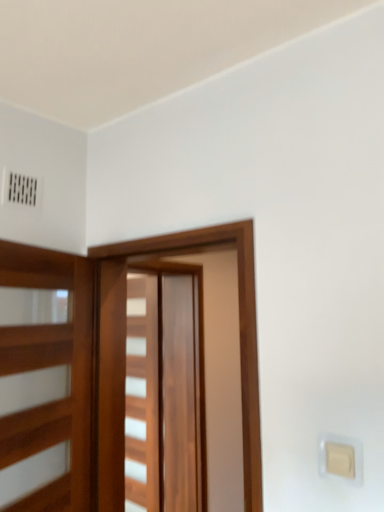
The height and width of the screenshot is (512, 384). Describe the element at coordinates (45, 379) in the screenshot. I see `wooden elevator at left` at that location.

This screenshot has width=384, height=512. Describe the element at coordinates (340, 459) in the screenshot. I see `beige plastic light switch at lower right` at that location.

Find the location of a particular element. The width and height of the screenshot is (384, 512). wooden barn door at center, which is the 1th barn door from front to back is located at coordinates (239, 320).

From the image's perspective, is beige plastic light switch at lower right located above or below wooden barn door at center, acting as the second barn door starting from the front?

beige plastic light switch at lower right is above wooden barn door at center, acting as the second barn door starting from the front.

Between beige plastic light switch at lower right and wooden barn door at center, acting as the second barn door starting from the front, which one has larger width?

wooden barn door at center, acting as the second barn door starting from the front, is wider.

Which is more to the left, beige plastic light switch at lower right or wooden barn door at center, which is the 1th barn door in back-to-front order?

wooden barn door at center, which is the 1th barn door in back-to-front order, is more to the left.

Looking at this image, considering the relative sizes of beige plastic light switch at lower right and wooden barn door at center, which is the 1th barn door in back-to-front order, in the image provided, is beige plastic light switch at lower right taller than wooden barn door at center, which is the 1th barn door in back-to-front order,?

No.

Is wooden barn door at center, which is the 1th barn door from front to back, facing away from beige plastic light switch at lower right?

No, beige plastic light switch at lower right is not at the back of wooden barn door at center, which is the 1th barn door from front to back.

Is the position of wooden barn door at center, the second barn door when ordered from back to front, more distant than that of beige plastic light switch at lower right?

Yes, wooden barn door at center, the second barn door when ordered from back to front, is further from the camera.

From a real-world perspective, relative to beige plastic light switch at lower right, is wooden barn door at center, which is the 1th barn door from front to back, vertically above or below?

wooden barn door at center, which is the 1th barn door from front to back, is above beige plastic light switch at lower right.

Is wooden barn door at center, the second barn door when ordered from back to front, far away from beige plastic light switch at lower right?

Actually, wooden barn door at center, the second barn door when ordered from back to front, and beige plastic light switch at lower right are a little close together.

Is wooden barn door at center, acting as the second barn door starting from the front, facing away from wooden barn door at center, the second barn door when ordered from back to front?

No, wooden barn door at center, acting as the second barn door starting from the front,'s orientation is not away from wooden barn door at center, the second barn door when ordered from back to front.

Considering the relative sizes of wooden barn door at center, acting as the second barn door starting from the front, and wooden barn door at center, the second barn door when ordered from back to front, in the image provided, is wooden barn door at center, acting as the second barn door starting from the front, wider than wooden barn door at center, the second barn door when ordered from back to front,?

Indeed, wooden barn door at center, acting as the second barn door starting from the front, has a greater width compared to wooden barn door at center, the second barn door when ordered from back to front.

Is wooden barn door at center, which is the 1th barn door in back-to-front order, taller than wooden barn door at center, which is the 1th barn door from front to back?

Correct, wooden barn door at center, which is the 1th barn door in back-to-front order, is much taller as wooden barn door at center, which is the 1th barn door from front to back.

Is wooden barn door at center, acting as the second barn door starting from the front, in front of wooden elevator at left?

No, wooden barn door at center, acting as the second barn door starting from the front, is behind wooden elevator at left.

From a real-world perspective, does wooden barn door at center, which is the 1th barn door in back-to-front order, sit lower than wooden elevator at left?

Yes, from a real-world perspective, wooden barn door at center, which is the 1th barn door in back-to-front order, is below wooden elevator at left.

Does wooden barn door at center, which is the 1th barn door in back-to-front order, have a larger size compared to wooden elevator at left?

Yes.

Which barn door is the 2nd one when counting from the back of the wooden elevator at left? Please provide its 2D coordinates.

[(164, 393)]

In terms of size, does beige plastic light switch at lower right appear bigger or smaller than wooden barn door at center, the second barn door when ordered from back to front?

Clearly, beige plastic light switch at lower right is smaller in size than wooden barn door at center, the second barn door when ordered from back to front.

Locate an element on the screen. the 1st barn door behind the beige plastic light switch at lower right is located at coordinates (239, 320).

From a real-world perspective, is beige plastic light switch at lower right located higher than wooden barn door at center, the second barn door when ordered from back to front?

No, from a real-world perspective, beige plastic light switch at lower right is not on top of wooden barn door at center, the second barn door when ordered from back to front.

Could you tell me if beige plastic light switch at lower right is facing wooden barn door at center, which is the 1th barn door from front to back?

No.

Is point (145, 240) positioned behind point (23, 350)?

Yes.

From the image's perspective, is wooden barn door at center, which is the 1th barn door from front to back, located above or below wooden elevator at left?

wooden barn door at center, which is the 1th barn door from front to back, is below wooden elevator at left.

Considering the sizes of objects wooden barn door at center, the second barn door when ordered from back to front, and wooden elevator at left in the image provided, who is bigger, wooden barn door at center, the second barn door when ordered from back to front, or wooden elevator at left?

With larger size is wooden barn door at center, the second barn door when ordered from back to front.

Based on the photo, does wooden barn door at center, which is the 1th barn door from front to back, appear on the left side of wooden elevator at left?

No, wooden barn door at center, which is the 1th barn door from front to back, is not to the left of wooden elevator at left.

In the scene shown: From the image's perspective, between wooden elevator at left and wooden barn door at center, acting as the second barn door starting from the front, who is located below?

wooden barn door at center, acting as the second barn door starting from the front, from the image's perspective.

I want to click on the 2nd barn door behind the wooden elevator at left, counting from the anchor's position, so click(x=164, y=393).

Who is smaller, wooden elevator at left or wooden barn door at center, which is the 1th barn door in back-to-front order?

Smaller between the two is wooden elevator at left.

How many degrees apart are the facing directions of wooden elevator at left and wooden barn door at center, which is the 1th barn door in back-to-front order?

The angle between the facing direction of wooden elevator at left and the facing direction of wooden barn door at center, which is the 1th barn door in back-to-front order, is 19.2 degrees.

Where is `the 2nd barn door behind the beige plastic light switch at lower right`? The height and width of the screenshot is (512, 384). the 2nd barn door behind the beige plastic light switch at lower right is located at coordinates (164, 393).

Where is `light switch below the wooden barn door at center, the second barn door when ordered from back to front (from the image's perspective)`? The height and width of the screenshot is (512, 384). light switch below the wooden barn door at center, the second barn door when ordered from back to front (from the image's perspective) is located at coordinates (340, 459).

Considering their positions, is beige plastic light switch at lower right positioned further to wooden elevator at left than wooden barn door at center, the second barn door when ordered from back to front?

beige plastic light switch at lower right lies further to wooden elevator at left than the other object.

Estimate the real-world distances between objects in this image. Which object is further from wooden barn door at center, the second barn door when ordered from back to front, wooden barn door at center, which is the 1th barn door in back-to-front order, or beige plastic light switch at lower right?

wooden barn door at center, which is the 1th barn door in back-to-front order, is further to wooden barn door at center, the second barn door when ordered from back to front.

Which object lies further to the anchor point wooden barn door at center, acting as the second barn door starting from the front, wooden barn door at center, which is the 1th barn door from front to back, or beige plastic light switch at lower right?

beige plastic light switch at lower right is further to wooden barn door at center, acting as the second barn door starting from the front.

Which object lies nearer to the anchor point beige plastic light switch at lower right, wooden barn door at center, the second barn door when ordered from back to front, or wooden barn door at center, acting as the second barn door starting from the front?

The object closer to beige plastic light switch at lower right is wooden barn door at center, the second barn door when ordered from back to front.

Which object lies nearer to the anchor point wooden barn door at center, the second barn door when ordered from back to front, wooden barn door at center, acting as the second barn door starting from the front, or wooden elevator at left?

Among the two, wooden elevator at left is located nearer to wooden barn door at center, the second barn door when ordered from back to front.

Looking at the image, which one is located closer to wooden barn door at center, the second barn door when ordered from back to front, wooden elevator at left or wooden barn door at center, which is the 1th barn door in back-to-front order?

Based on the image, wooden elevator at left appears to be nearer to wooden barn door at center, the second barn door when ordered from back to front.

Estimate the real-world distances between objects in this image. Which object is further from wooden elevator at left, wooden barn door at center, acting as the second barn door starting from the front, or wooden barn door at center, which is the 1th barn door from front to back?

wooden barn door at center, acting as the second barn door starting from the front, is positioned further to the anchor wooden elevator at left.

Considering their positions, is wooden barn door at center, acting as the second barn door starting from the front, positioned closer to beige plastic light switch at lower right than wooden elevator at left?

The object closer to beige plastic light switch at lower right is wooden elevator at left.

The height and width of the screenshot is (512, 384). What are the coordinates of `barn door between beige plastic light switch at lower right and wooden barn door at center, which is the 1th barn door in back-to-front order, in the front-back direction` in the screenshot? It's located at (239, 320).

I want to click on elevator between beige plastic light switch at lower right and wooden barn door at center, acting as the second barn door starting from the front, from front to back, so click(45, 379).

The image size is (384, 512). Identify the location of barn door positioned between wooden elevator at left and wooden barn door at center, acting as the second barn door starting from the front, from near to far. (239, 320).